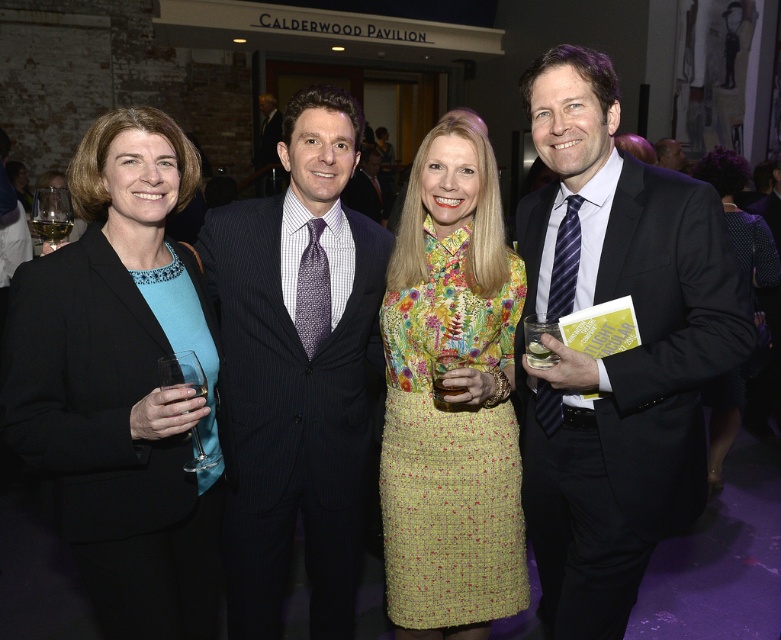
Is black suit at right shorter than floral fabric dress at center?

No.

Is point (576, 417) positioned before point (490, 296)?

Yes, it is.

Is point (601, 492) positioned behind point (440, 236)?

No, (601, 492) is in front of (440, 236).

The height and width of the screenshot is (640, 781). In order to click on black suit at right in this screenshot , I will do `click(615, 353)`.

Which is in front, point (173, 161) or point (448, 257)?

Point (173, 161) is more forward.

Can you confirm if black fabric blazer at left is positioned above floral fabric dress at center?

Yes.

Which is behind, point (138, 276) or point (426, 538)?

Positioned behind is point (426, 538).

You are a GUI agent. You are given a task and a screenshot of the screen. Output one action in this format:
    pyautogui.click(x=<x>, y=<y>)
    Task: Click on the black fabric blazer at left
    The image size is (781, 640).
    Given the screenshot: What is the action you would take?
    pyautogui.click(x=122, y=384)

Is point (287, 355) positioned before point (676, 164)?

Yes, point (287, 355) is in front of point (676, 164).

Does dark blue pinstripe suit at center appear on the right side of matte black suit at center?

No, dark blue pinstripe suit at center is not to the right of matte black suit at center.

Identify the location of dark blue pinstripe suit at center. This screenshot has height=640, width=781. (298, 371).

Identify the location of dark blue pinstripe suit at center. The image size is (781, 640). (298, 371).